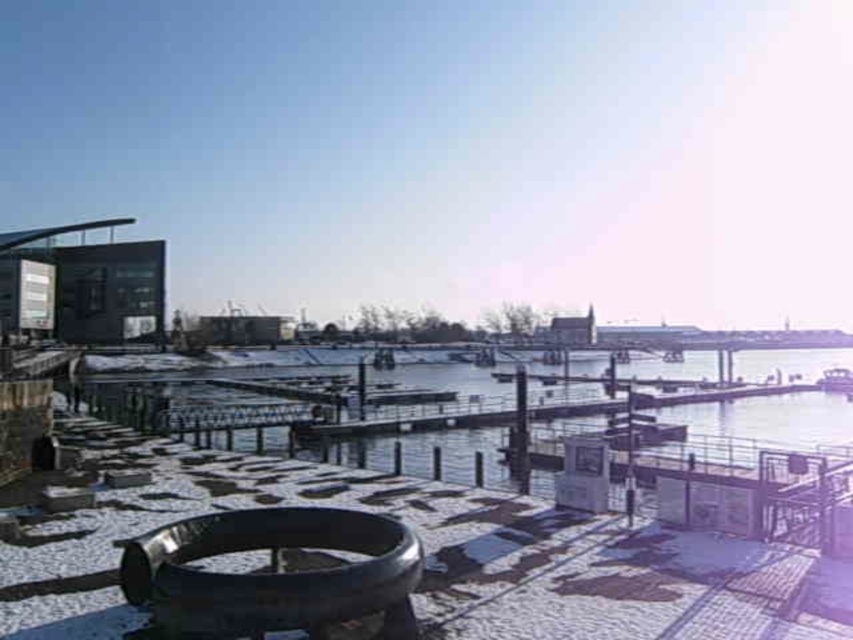
Question: Which of the following is the closest to the observer?

Choices:
 (A) (839, 371)
 (B) (231, 529)

Answer: (B)

Question: Is shiny black tire at lower center below metallic silver boat at lower right?

Choices:
 (A) yes
 (B) no

Answer: (B)

Question: Which point is farther from the camera taking this photo?

Choices:
 (A) (422, 557)
 (B) (827, 385)

Answer: (B)

Question: Observing the image, what is the correct spatial positioning of shiny black tire at lower center in reference to metallic silver boat at lower right?

Choices:
 (A) left
 (B) right

Answer: (A)

Question: Is the position of shiny black tire at lower center less distant than that of metallic silver boat at lower right?

Choices:
 (A) yes
 (B) no

Answer: (A)

Question: Which point appears farthest from the camera in this image?

Choices:
 (A) (850, 392)
 (B) (308, 524)

Answer: (A)